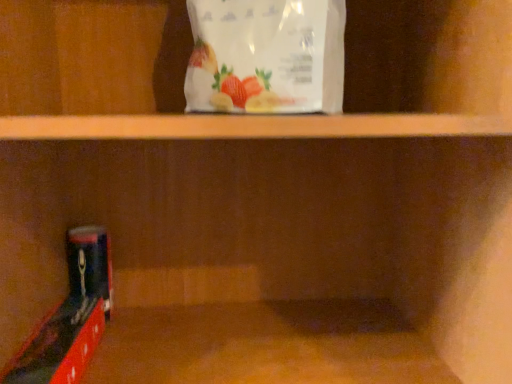
Where is `translucent plastic bag at upper center`? translucent plastic bag at upper center is located at coordinates (266, 56).

The height and width of the screenshot is (384, 512). What do you see at coordinates (266, 56) in the screenshot?
I see `translucent plastic bag at upper center` at bounding box center [266, 56].

The height and width of the screenshot is (384, 512). Identify the location of translucent plastic bag at upper center. (266, 56).